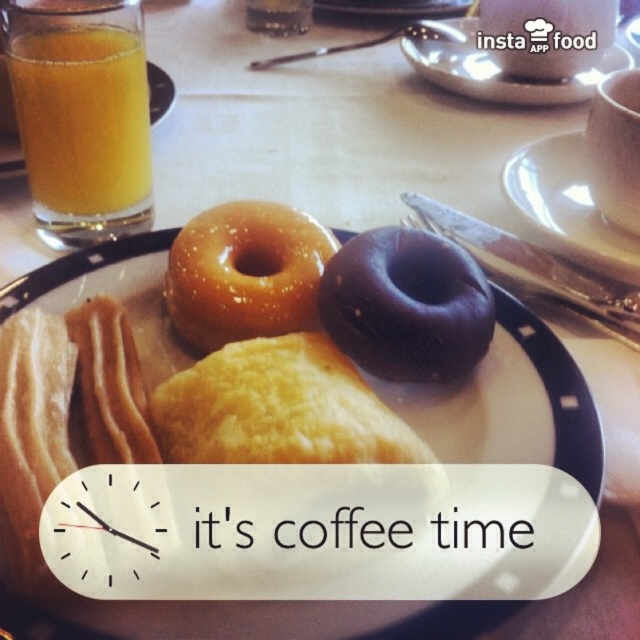
Question: Considering the real-world distances, which object is closest to the glossy ceramic plate at upper center?

Choices:
 (A) translucent glass mug at upper left
 (B) matte caramel donut at center

Answer: (A)

Question: Does chocolate glazed donut at center lie behind matte glazed donuts at center?

Choices:
 (A) no
 (B) yes

Answer: (B)

Question: Which point is closer to the camera?

Choices:
 (A) orange liquid at upper left
 (B) translucent glass orange juice at upper left

Answer: (B)

Question: Can you confirm if matte glazed donuts at center is positioned to the left of translucent glass mug at upper left?

Choices:
 (A) no
 (B) yes

Answer: (B)

Question: Considering the relative positions of translucent glass mug at upper left and orange liquid at upper left in the image provided, where is translucent glass mug at upper left located with respect to orange liquid at upper left?

Choices:
 (A) left
 (B) right

Answer: (B)

Question: Which point is closer to the camera?

Choices:
 (A) (256, 29)
 (B) (529, 198)
 (C) (508, 74)
 (D) (305, 330)

Answer: (D)